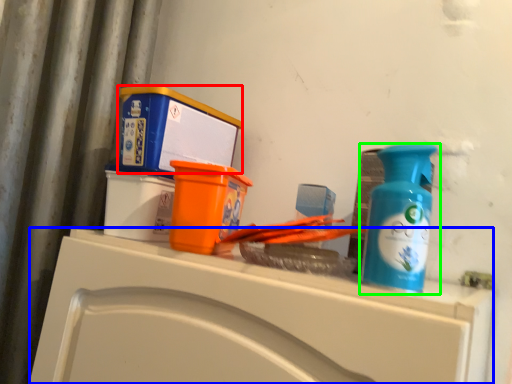
Question: Which object is the closest to the box (highlighted by a red box)? Choose among these: counter (highlighted by a blue box) or bottle (highlighted by a green box).

Choices:
 (A) counter
 (B) bottle

Answer: (A)